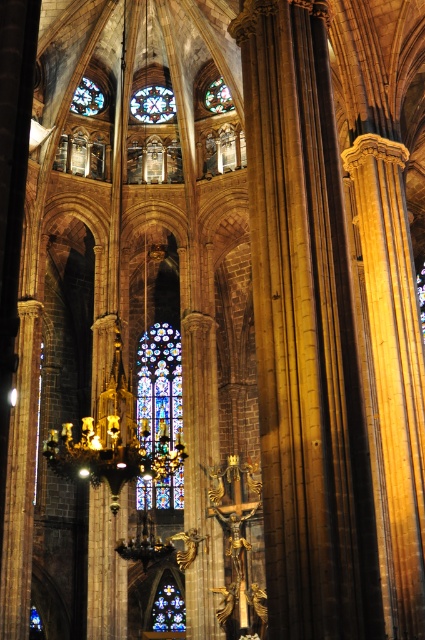
Question: Considering the relative positions of golden polished stone column at center and stained glass at upper center in the image provided, where is golden polished stone column at center located with respect to stained glass at upper center?

Choices:
 (A) below
 (B) above

Answer: (A)

Question: Which point is farther to the camera?

Choices:
 (A) stained glass at upper center
 (B) stained glass window at center
 (C) golden polished stone column at center
 (D) stained glass window at upper center

Answer: (A)

Question: Can you confirm if stained glass window at center is smaller than stained glass window at upper center?

Choices:
 (A) no
 (B) yes

Answer: (A)

Question: Which object appears closest to the camera in this image?

Choices:
 (A) golden polished stone column at center
 (B) stained glass window at upper left
 (C) stained glass window at center

Answer: (A)

Question: Which of the following is the farthest from the observer?

Choices:
 (A) stained glass window at upper center
 (B) golden polished stone column at center

Answer: (A)

Question: Is the position of golden polished stone column at center less distant than that of stained glass window at upper center?

Choices:
 (A) yes
 (B) no

Answer: (A)